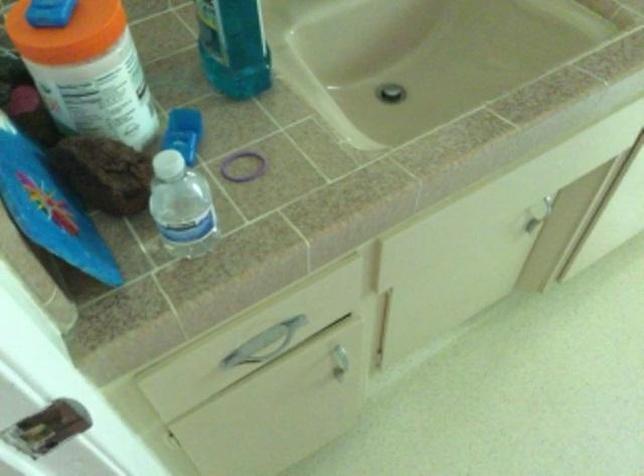
Where would you twist the white bottle cap? Please return your answer as a coordinate pair (x, y).

(181, 205)